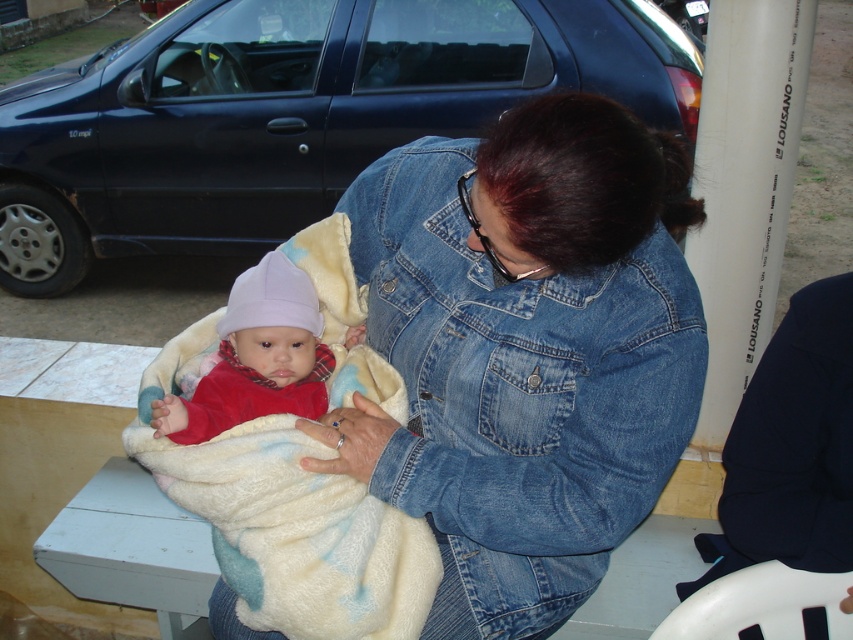
Question: Which object is the farthest from the denim jacket at center?

Choices:
 (A) fluffy white blanket at center
 (B) matte red sweater at center

Answer: (B)

Question: Does denim jacket at center appear on the left side of fluffy white blanket at center?

Choices:
 (A) yes
 (B) no

Answer: (B)

Question: Which point is farther from the camera taking this photo?

Choices:
 (A) (442, 440)
 (B) (230, 509)

Answer: (A)

Question: Estimate the real-world distances between objects in this image. Which object is farther from the fluffy white blanket at center?

Choices:
 (A) matte red sweater at center
 (B) denim jacket at center

Answer: (B)

Question: Can you confirm if denim jacket at center is positioned above matte red sweater at center?

Choices:
 (A) yes
 (B) no

Answer: (B)

Question: Can you confirm if fluffy white blanket at center is wider than matte red sweater at center?

Choices:
 (A) no
 (B) yes

Answer: (B)